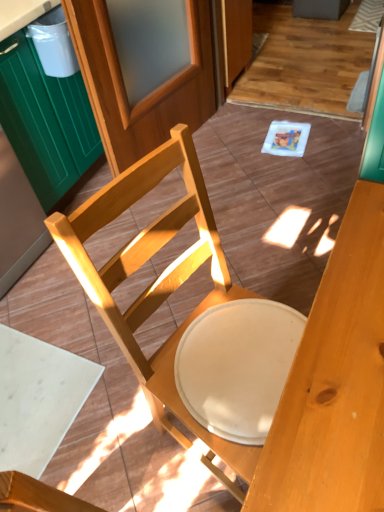
Question: From the image's perspective, is wooden screen door at upper center on green wood cabinet at left?

Choices:
 (A) no
 (B) yes

Answer: (B)

Question: Is the position of wooden screen door at upper center more distant than that of green wood cabinet at left?

Choices:
 (A) yes
 (B) no

Answer: (A)

Question: From a real-world perspective, does wooden screen door at upper center stand above green wood cabinet at left?

Choices:
 (A) no
 (B) yes

Answer: (B)

Question: Can you confirm if wooden screen door at upper center is taller than green wood cabinet at left?

Choices:
 (A) yes
 (B) no

Answer: (A)

Question: Is the position of wooden screen door at upper center less distant than that of green wood cabinet at left?

Choices:
 (A) no
 (B) yes

Answer: (A)

Question: From their relative heights in the image, would you say green wood cabinet at left is taller or shorter than white plastic trash bin at upper left?

Choices:
 (A) short
 (B) tall

Answer: (B)

Question: Is green wood cabinet at left wider or thinner than white plastic trash bin at upper left?

Choices:
 (A) wide
 (B) thin

Answer: (A)

Question: Is point (62, 121) closer or farther from the camera than point (66, 39)?

Choices:
 (A) farther
 (B) closer

Answer: (A)

Question: Looking at the image, does green wood cabinet at left seem bigger or smaller compared to white plastic trash bin at upper left?

Choices:
 (A) big
 (B) small

Answer: (A)

Question: Visually, is wooden chair at center positioned to the left or to the right of white plastic trash bin at upper left?

Choices:
 (A) left
 (B) right

Answer: (B)

Question: Is point (230, 456) positioned closer to the camera than point (49, 34)?

Choices:
 (A) farther
 (B) closer

Answer: (B)

Question: Is wooden chair at center taller or shorter than white plastic trash bin at upper left?

Choices:
 (A) short
 (B) tall

Answer: (B)

Question: In the image, is wooden chair at center positioned in front of or behind white plastic trash bin at upper left?

Choices:
 (A) behind
 (B) front

Answer: (B)

Question: Considering the relative positions of wooden screen door at upper center and white plastic trash bin at upper left in the image provided, is wooden screen door at upper center to the left or to the right of white plastic trash bin at upper left?

Choices:
 (A) left
 (B) right

Answer: (B)

Question: From a real-world perspective, is wooden screen door at upper center physically located above or below white plastic trash bin at upper left?

Choices:
 (A) above
 (B) below

Answer: (B)